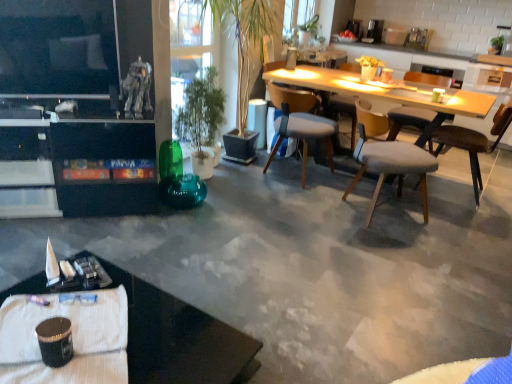
Identify the location of vacant space situated above black glossy desk at lower left (from a real-world perspective). Image resolution: width=512 pixels, height=384 pixels. (103, 330).